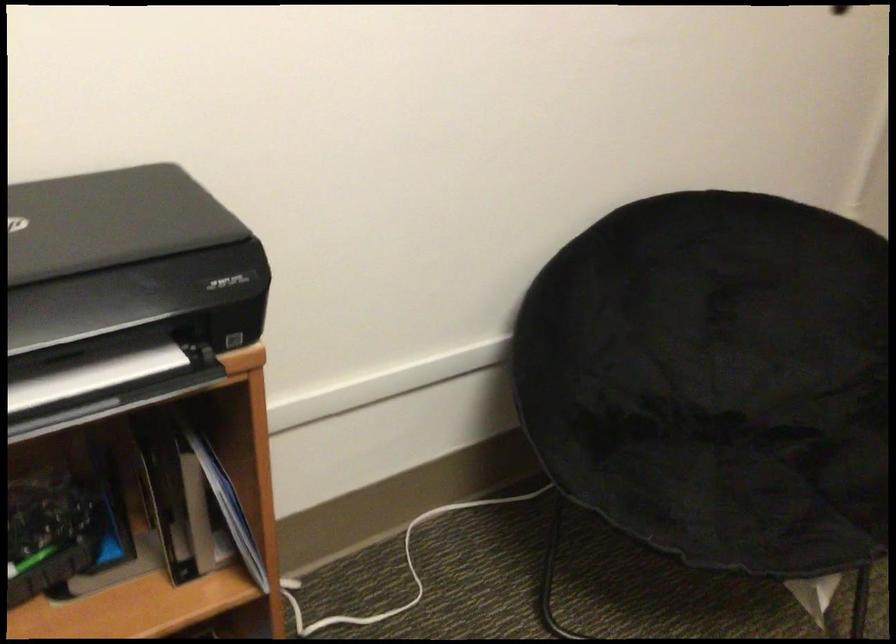
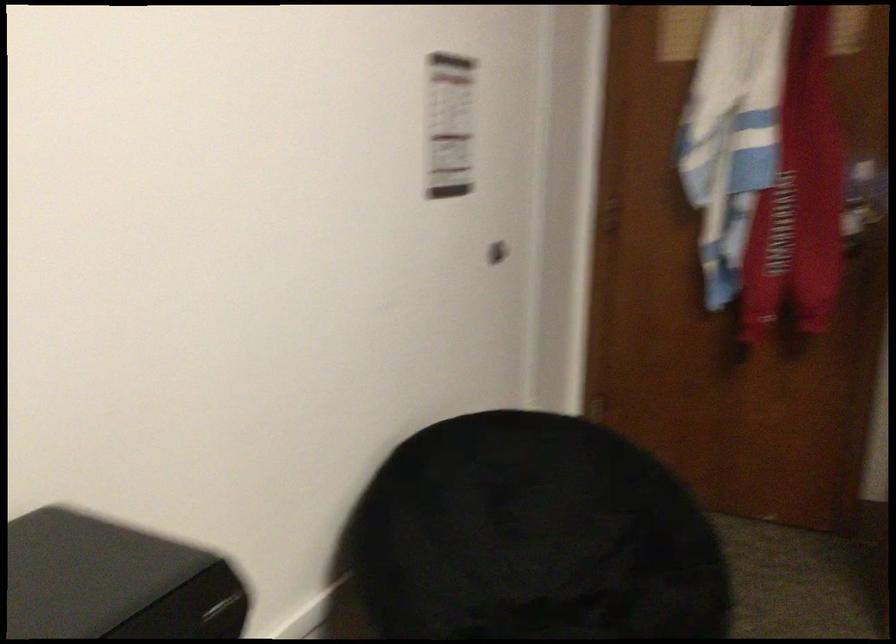
Question: The first image is from the beginning of the video and the second image is from the end. How did the camera likely rotate when shooting the video?

Choices:
 (A) Left
 (B) Right
 (C) Up
 (D) Down

Answer: (B)